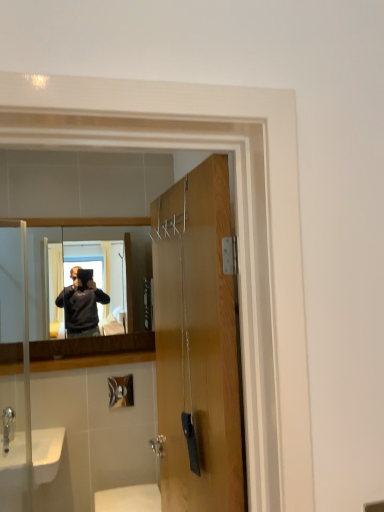
Question: Does silver metallic faucet at lower left turn towards white glossy sink at lower left?

Choices:
 (A) yes
 (B) no

Answer: (B)

Question: Is silver metallic faucet at lower left positioned with its back to white glossy sink at lower left?

Choices:
 (A) no
 (B) yes

Answer: (A)

Question: Considering the relative sizes of silver metallic faucet at lower left and white glossy sink at lower left in the image provided, is silver metallic faucet at lower left smaller than white glossy sink at lower left?

Choices:
 (A) no
 (B) yes

Answer: (B)

Question: Are silver metallic faucet at lower left and white glossy sink at lower left located far from each other?

Choices:
 (A) no
 (B) yes

Answer: (A)

Question: From a real-world perspective, is silver metallic faucet at lower left on top of white glossy sink at lower left?

Choices:
 (A) yes
 (B) no

Answer: (A)

Question: Can you confirm if silver metallic faucet at lower left is bigger than white glossy sink at lower left?

Choices:
 (A) no
 (B) yes

Answer: (A)

Question: Is matte wooden mirror at center oriented away from silver metallic faucet at lower left?

Choices:
 (A) yes
 (B) no

Answer: (B)

Question: Is matte wooden mirror at center further to the viewer compared to silver metallic faucet at lower left?

Choices:
 (A) no
 (B) yes

Answer: (B)

Question: Is matte wooden mirror at center facing towards silver metallic faucet at lower left?

Choices:
 (A) no
 (B) yes

Answer: (A)

Question: Does matte wooden mirror at center have a greater width compared to silver metallic faucet at lower left?

Choices:
 (A) yes
 (B) no

Answer: (B)

Question: Does matte wooden mirror at center have a smaller size compared to silver metallic faucet at lower left?

Choices:
 (A) yes
 (B) no

Answer: (B)

Question: From the image's perspective, would you say matte wooden mirror at center is positioned over silver metallic faucet at lower left?

Choices:
 (A) yes
 (B) no

Answer: (A)

Question: Is the position of matte wooden mirror at center less distant than that of wooden door at center?

Choices:
 (A) yes
 (B) no

Answer: (B)